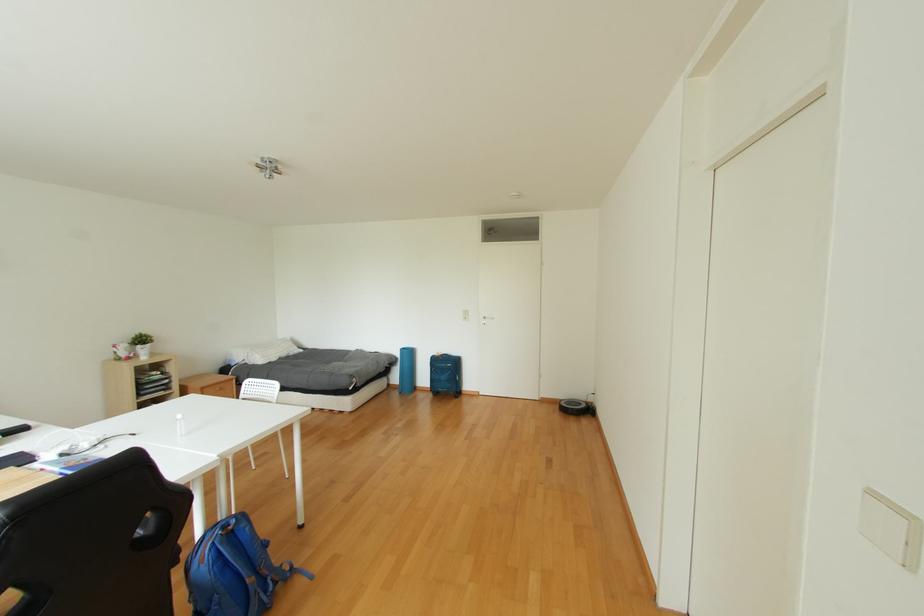
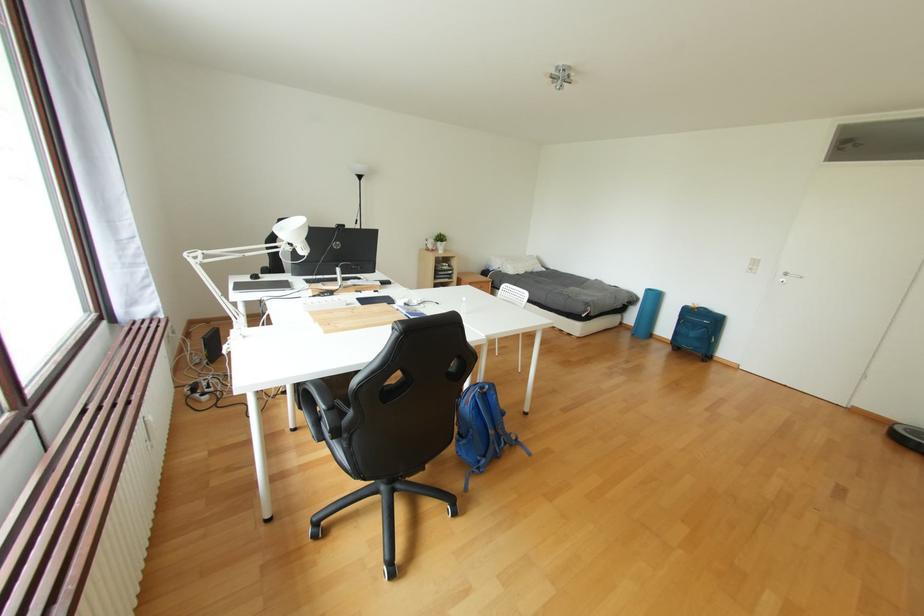
Question: The first image is from the beginning of the video and the second image is from the end. How did the camera likely rotate when shooting the video?

Choices:
 (A) Left
 (B) Right
 (C) Up
 (D) Down

Answer: (A)